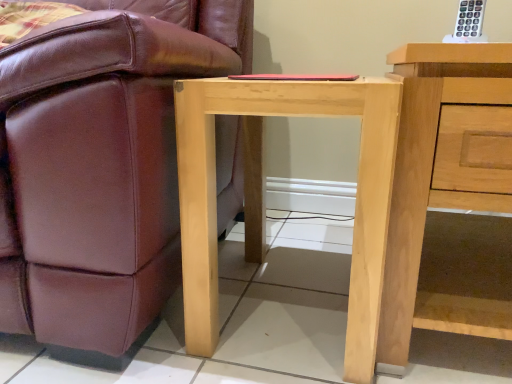
Identify the location of vacant space underneath natural wood table at center (from a real-world perspective). The height and width of the screenshot is (384, 512). (292, 304).